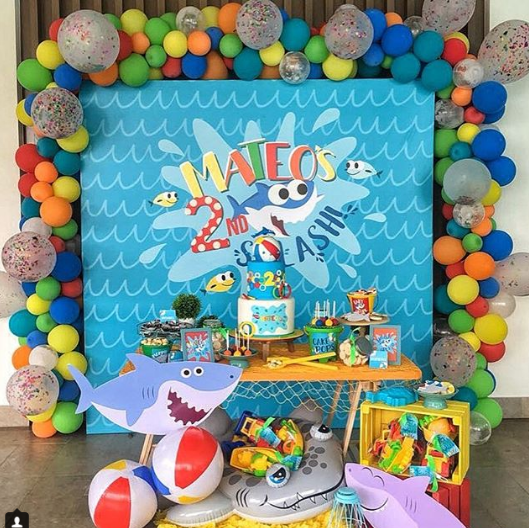
Find the location of `wall`. wall is located at coordinates (506, 354).